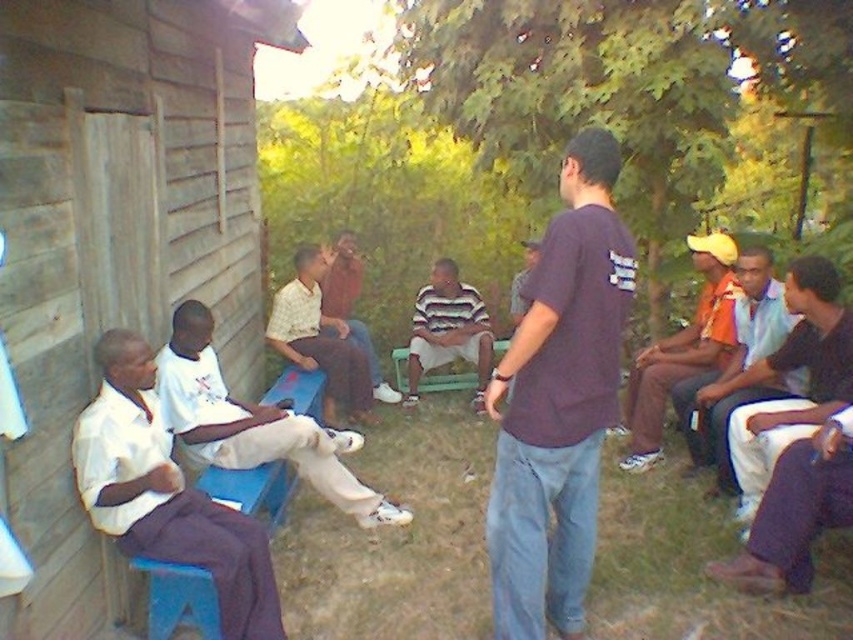
This screenshot has width=853, height=640. What do you see at coordinates (165, 493) in the screenshot?
I see `white matte shirt at left` at bounding box center [165, 493].

Does white matte shirt at left appear on the left side of striped cotton shirt at center?

Yes, white matte shirt at left is to the left of striped cotton shirt at center.

Measure the distance between white matte shirt at left and camera.

white matte shirt at left and camera are 2.40 meters apart.

Image resolution: width=853 pixels, height=640 pixels. What are the coordinates of `white matte shirt at left` in the screenshot? It's located at (165, 493).

Does orange fabric shirt at right have a lesser width compared to light brown fabric shirt at center?

Correct, orange fabric shirt at right's width is less than light brown fabric shirt at center's.

Is point (653, 404) closer to camera compared to point (335, 368)?

Yes, point (653, 404) is in front of point (335, 368).

Locate an element on the screen. orange fabric shirt at right is located at coordinates (682, 349).

Measure the distance between point (218, 58) and camera.

Point (218, 58) is 3.89 meters away from camera.

Can you confirm if wooden bench at left is smaller than orange shirt at center?

Incorrect, wooden bench at left is not smaller in size than orange shirt at center.

At what (x,y) coordinates should I click in order to perform the action: click on wooden bench at left. Please return your answer as a coordinate pair (x, y). Looking at the image, I should click on (119, 234).

In order to click on wooden bench at left in this screenshot , I will do `click(119, 234)`.